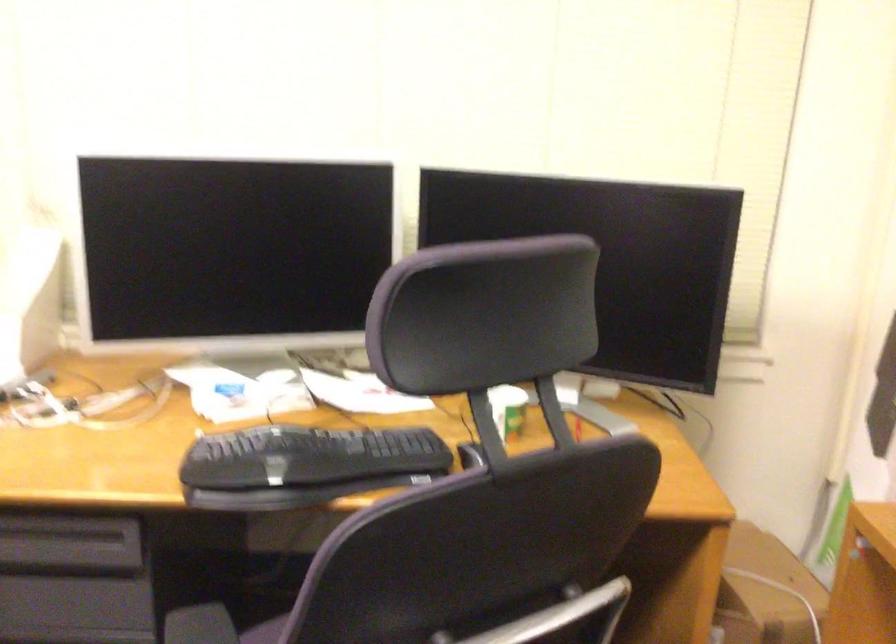
Find where to pull the drawer handle. Please return your answer as a coordinate pair (x, y).

(66, 552)